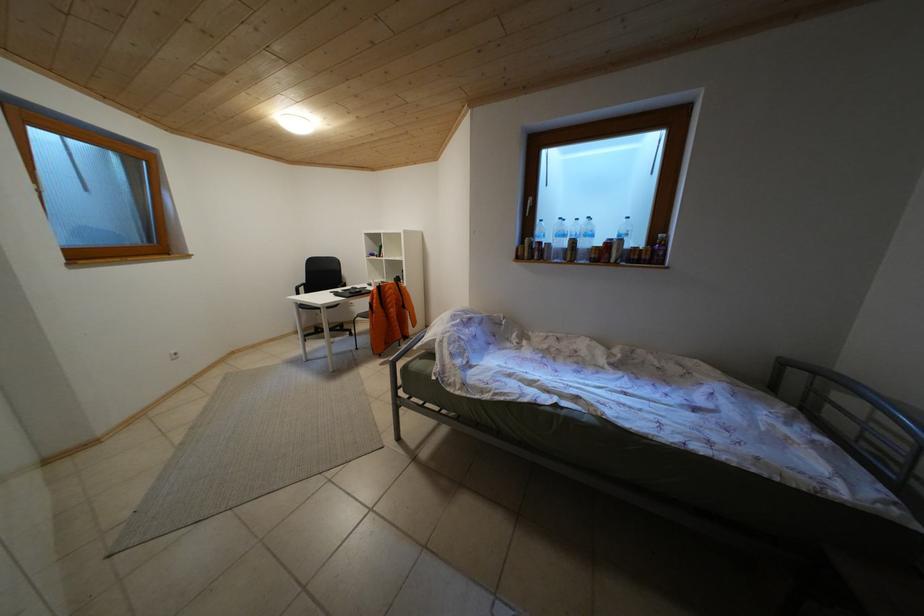
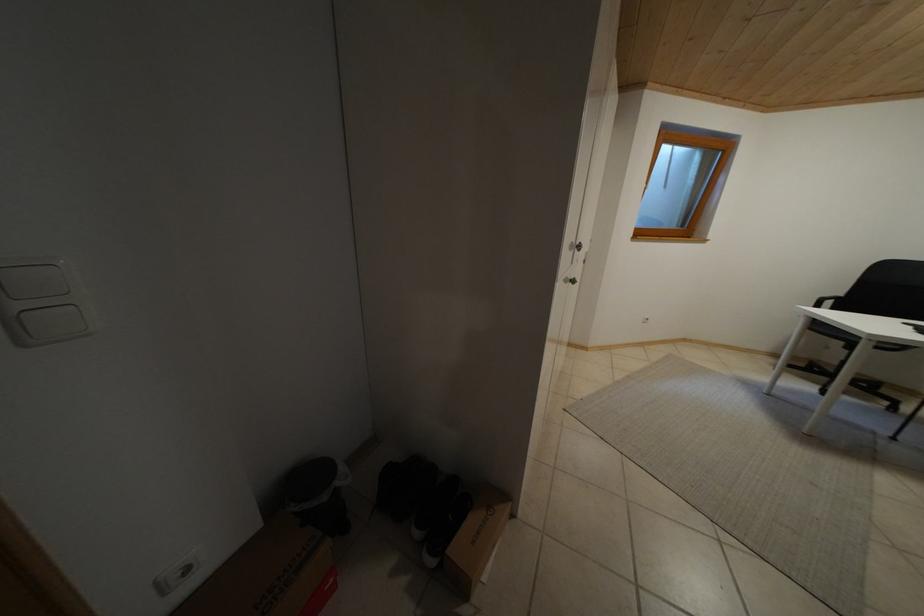
The first image is from the beginning of the video and the second image is from the end. How did the camera likely rotate when shooting the video?

The camera's rotation is toward left-down.